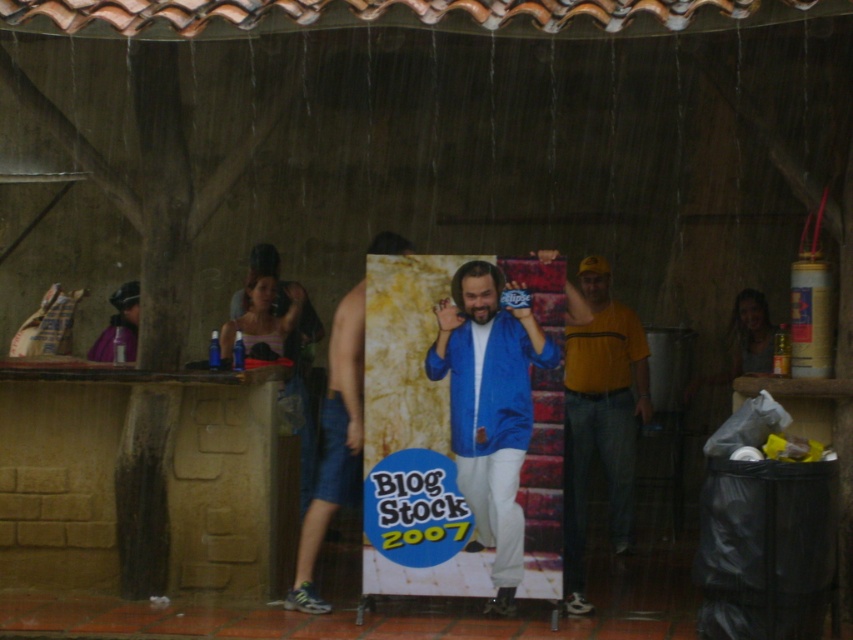
Between point (578, 323) and point (315, 509), which one is positioned in front?

Point (578, 323) is more forward.

Does yellow cotton t-shirt at right appear under denim shorts at center?

No.

Is point (613, 538) positioned after point (309, 579)?

Yes, it is.

Identify the location of yellow cotton t-shirt at right. (599, 413).

Does blue shiny jacket at center have a smaller size compared to yellow cotton t-shirt at right?

Yes, blue shiny jacket at center is smaller than yellow cotton t-shirt at right.

Measure the distance between point (526, 413) and camera.

They are 29.16 feet apart.

Locate an element on the screen. Image resolution: width=853 pixels, height=640 pixels. blue shiny jacket at center is located at coordinates (490, 406).

Is blue shiny jacket at center taller than denim shorts at center?

Yes.

Between point (514, 589) and point (358, 444), which one is positioned behind?

Positioned behind is point (358, 444).

Locate an element on the screen. The width and height of the screenshot is (853, 640). blue shiny jacket at center is located at coordinates (490, 406).